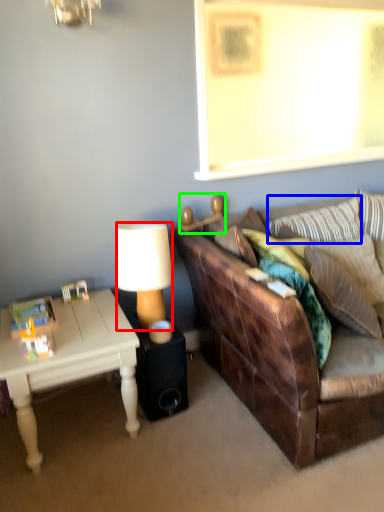
Question: Which object is the farthest from lamp (highlighted by a red box)? Choose among these: pillow (highlighted by a blue box) or lamp (highlighted by a green box).

Choices:
 (A) pillow
 (B) lamp

Answer: (A)